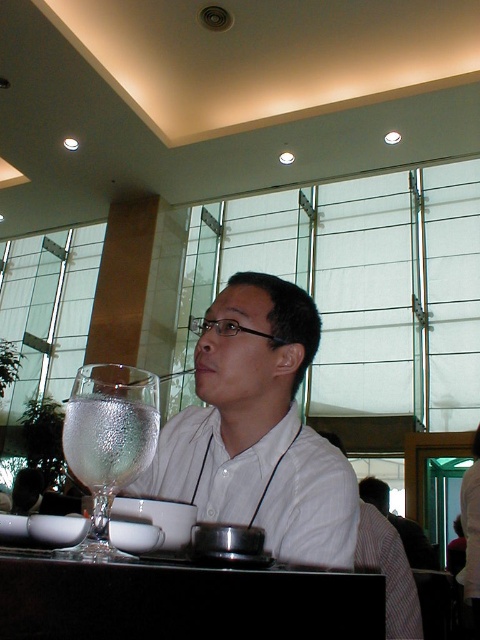
Question: Based on their relative distances, which object is nearer to the black glossy table at lower center?

Choices:
 (A) white shirt at center
 (B) clear glass water at left

Answer: (B)

Question: Does clear glass wine glass at left appear under clear glass water at left?

Choices:
 (A) no
 (B) yes

Answer: (B)

Question: Can you confirm if white shirt at center is smaller than black glossy table at lower center?

Choices:
 (A) yes
 (B) no

Answer: (B)

Question: Which point is closer to the camera?

Choices:
 (A) (88, 484)
 (B) (158, 406)

Answer: (A)

Question: Which object appears farthest from the camera in this image?

Choices:
 (A) clear glass water at left
 (B) clear glass wine glass at left
 (C) white shirt at center

Answer: (C)

Question: Is white shirt at center above clear glass water at left?

Choices:
 (A) no
 (B) yes

Answer: (A)